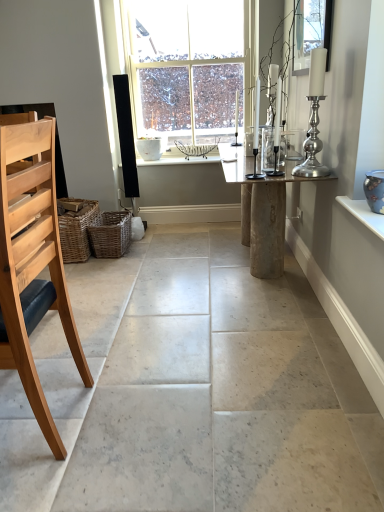
Locate an element on the screen. free location to the left of rustic wood table at center is located at coordinates (163, 269).